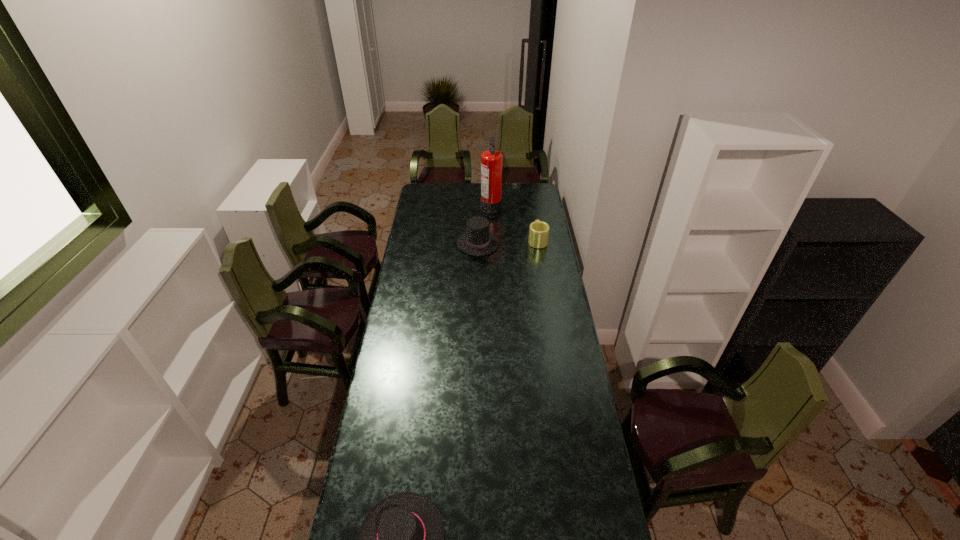
Find the location of a particular element. fire extinguisher is located at coordinates (491, 160).

Locate an element on the screen. the farthest object is located at coordinates (491, 160).

Find the location of `the taller dress hat`. the taller dress hat is located at coordinates (478, 241).

Where is `the farther dress hat`? The width and height of the screenshot is (960, 540). the farther dress hat is located at coordinates (478, 241).

Identify the location of the rightmost object. (538, 231).

You are a GUI agent. You are given a task and a screenshot of the screen. Output one action in this format:
    pyautogui.click(x=<x>, y=<y>)
    Task: Click on the third tallest object
    The width and height of the screenshot is (960, 540).
    Given the screenshot: What is the action you would take?
    pyautogui.click(x=538, y=231)

The image size is (960, 540). Find the location of `vacant region located 0.230m on the front-facing side of the farthest object`. vacant region located 0.230m on the front-facing side of the farthest object is located at coordinates (444, 205).

In order to click on free space located 0.300m on the front-facing side of the farthest object in this screenshot , I will do `click(433, 205)`.

Image resolution: width=960 pixels, height=540 pixels. What are the coordinates of `vacant space situated 0.180m on the front-facing side of the farthest object` in the screenshot? It's located at (452, 205).

Locate an element on the screen. free space located 0.080m on the front of the farther dress hat with the decoration is located at coordinates (514, 244).